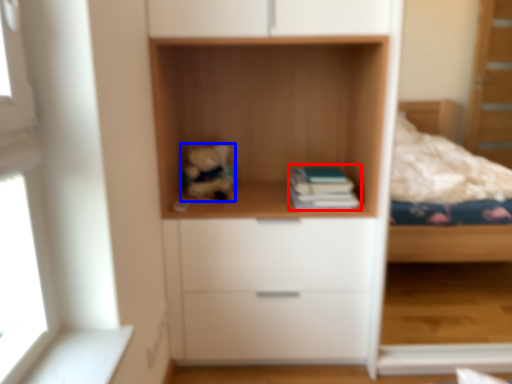
Question: Which object appears closest to the camera in this image, paperback book (highlighted by a red box) or toy (highlighted by a blue box)?

Choices:
 (A) paperback book
 (B) toy

Answer: (A)